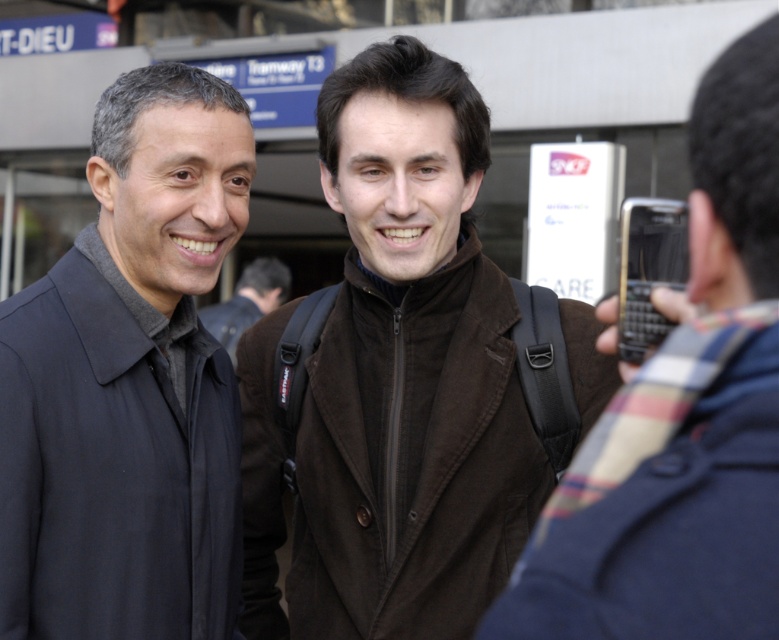
Question: Does brown woolen coat at center appear over black plastic phone at right?

Choices:
 (A) no
 (B) yes

Answer: (A)

Question: Which of the following is the closest to the observer?

Choices:
 (A) black plastic phone at right
 (B) plaid scarf at upper right
 (C) matte black jacket at left

Answer: (B)

Question: Is matte black jacket at left smaller than black plastic phone at right?

Choices:
 (A) yes
 (B) no

Answer: (B)

Question: Does brown woolen coat at center appear on the right side of black plastic phone at right?

Choices:
 (A) yes
 (B) no

Answer: (B)

Question: Which of the following is the closest to the observer?

Choices:
 (A) black plastic phone at right
 (B) plaid scarf at upper right
 (C) matte black jacket at left
 (D) brown leather jacket at center

Answer: (B)

Question: Which object is closer to the camera taking this photo?

Choices:
 (A) black plastic phone at right
 (B) matte black jacket at left
 (C) brown woolen coat at center

Answer: (A)